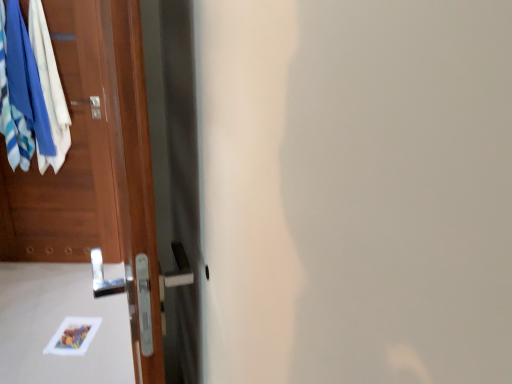
Question: Is the surface of blue cotton socks at left in direct contact with wooden door at left?

Choices:
 (A) yes
 (B) no

Answer: (B)

Question: Does blue cotton socks at left have a lesser width compared to wooden door at left?

Choices:
 (A) yes
 (B) no

Answer: (A)

Question: Considering the relative positions of blue cotton socks at left and wooden door at left in the image provided, is blue cotton socks at left behind wooden door at left?

Choices:
 (A) no
 (B) yes

Answer: (B)

Question: Is blue cotton socks at left taller than wooden door at left?

Choices:
 (A) no
 (B) yes

Answer: (A)

Question: From the image's perspective, is blue cotton socks at left below wooden door at left?

Choices:
 (A) yes
 (B) no

Answer: (B)

Question: Is blue cotton socks at left not close to wooden door at left?

Choices:
 (A) no
 (B) yes

Answer: (A)

Question: Is the depth of wooden door at left less than that of blue cotton socks at left?

Choices:
 (A) yes
 (B) no

Answer: (A)

Question: Would you say blue cotton socks at left is part of wooden door at left's contents?

Choices:
 (A) no
 (B) yes

Answer: (A)

Question: From the image's perspective, is wooden door at left on top of blue cotton socks at left?

Choices:
 (A) no
 (B) yes

Answer: (A)

Question: Considering the relative sizes of wooden door at left and blue cotton socks at left in the image provided, is wooden door at left thinner than blue cotton socks at left?

Choices:
 (A) yes
 (B) no

Answer: (B)

Question: From a real-world perspective, is wooden door at left positioned over blue cotton socks at left based on gravity?

Choices:
 (A) no
 (B) yes

Answer: (A)

Question: Considering the relative sizes of wooden door at left and blue cotton socks at left in the image provided, is wooden door at left shorter than blue cotton socks at left?

Choices:
 (A) no
 (B) yes

Answer: (A)

Question: Is blue cotton socks at left spatially inside wooden door at left, or outside of it?

Choices:
 (A) inside
 (B) outside

Answer: (B)